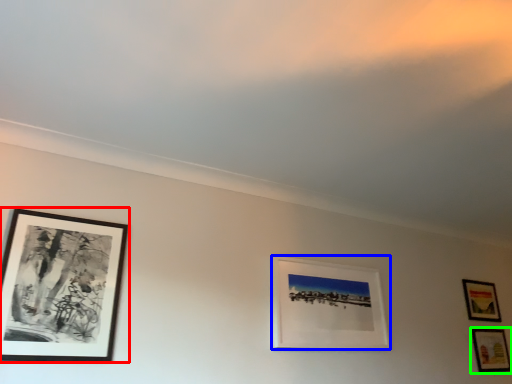
Question: Which object is the closest to the picture frame (highlighted by a red box)? Choose among these: picture frame (highlighted by a blue box) or picture frame (highlighted by a green box).

Choices:
 (A) picture frame
 (B) picture frame

Answer: (A)